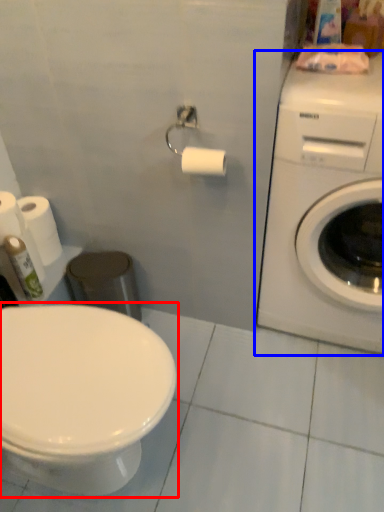
Question: Which object is closer to the camera taking this photo, toilet (highlighted by a red box) or washing machine (highlighted by a blue box)?

Choices:
 (A) toilet
 (B) washing machine

Answer: (A)